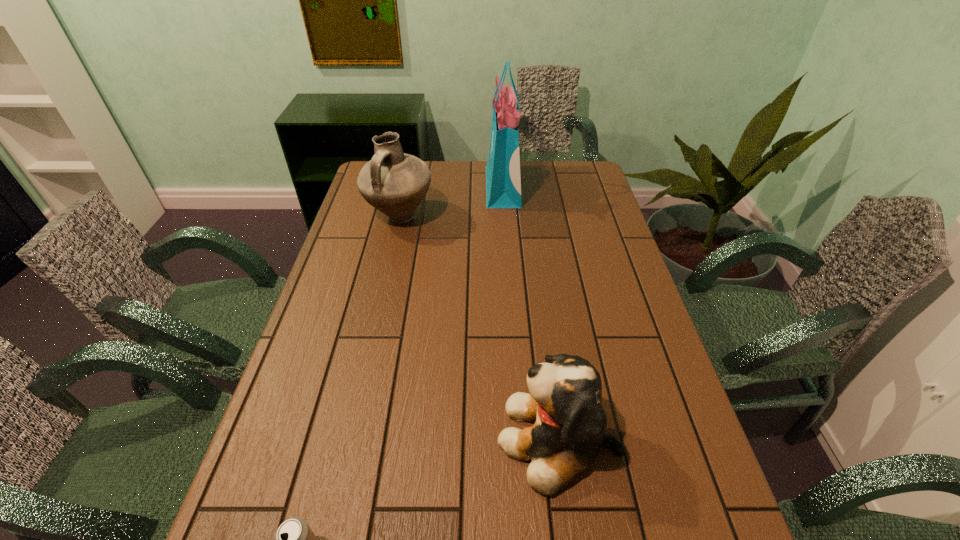
Locate an element on the screen. shopping bag is located at coordinates (503, 180).

You are a GUI agent. You are given a task and a screenshot of the screen. Output one action in this format:
    pyautogui.click(x=<x>, y=<y>)
    Task: Click on the third shortest object
    Image resolution: width=960 pixels, height=540 pixels.
    Given the screenshot: What is the action you would take?
    pyautogui.click(x=395, y=183)

Image resolution: width=960 pixels, height=540 pixels. What are the coordinates of `the second nearest object` in the screenshot? It's located at (565, 397).

You are a GUI agent. You are given a task and a screenshot of the screen. Output one action in this format:
    pyautogui.click(x=<x>, y=<y>)
    Task: Click on the puppy
    
    Given the screenshot: What is the action you would take?
    pyautogui.click(x=565, y=397)

Locate an element on the screen. This screenshot has height=540, width=960. vacant space situated on the front of the shopping bag is located at coordinates pos(509,276).

The height and width of the screenshot is (540, 960). In order to click on vacant space located on the handle side of the pitcher in this screenshot , I will do `click(389, 267)`.

Locate an element on the screen. The height and width of the screenshot is (540, 960). free location located at the face of the second nearest object is located at coordinates (432, 437).

Find the location of a particular element. This screenshot has width=960, height=540. free space located 0.090m at the face of the second nearest object is located at coordinates (456, 437).

Where is `free location located at the face of the second nearest object`? The image size is (960, 540). free location located at the face of the second nearest object is located at coordinates (345, 437).

Where is `object at the far edge`? The image size is (960, 540). object at the far edge is located at coordinates (503, 180).